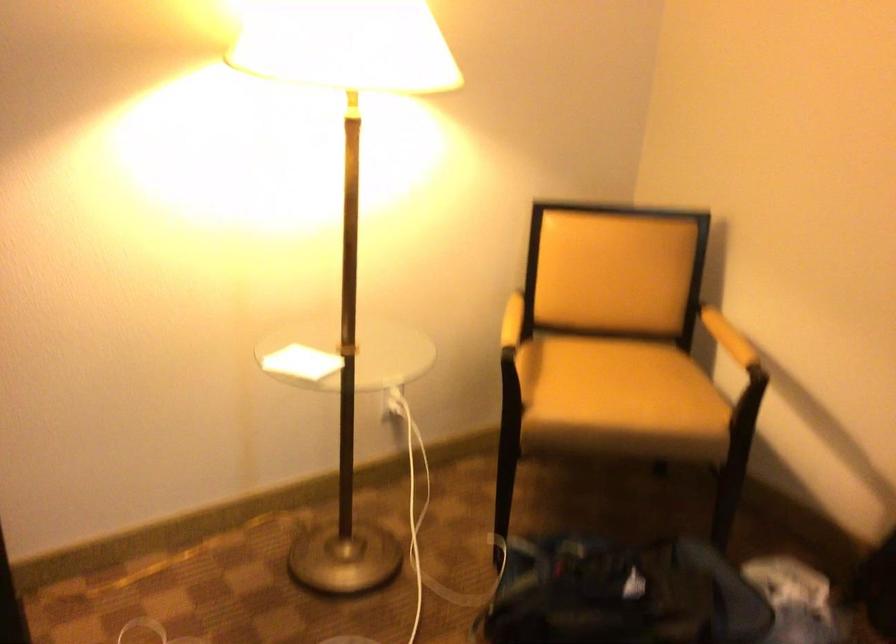
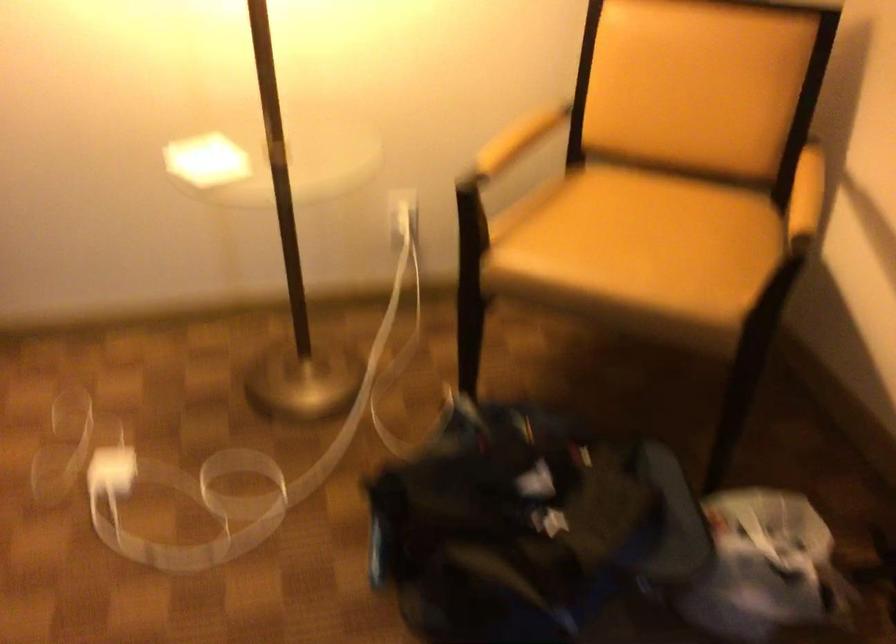
Question: The camera is either moving clockwise (left) or counter-clockwise (right) around the object. The first image is from the beginning of the video and the second image is from the end. Is the camera moving left or right when shooting the video?

Choices:
 (A) Left
 (B) Right

Answer: (B)